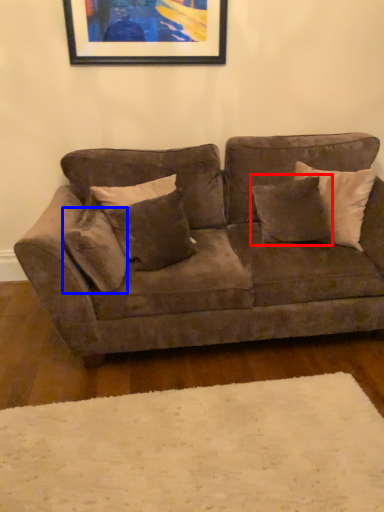
Question: Which point is further to the camera, pillow (highlighted by a red box) or pillow (highlighted by a blue box)?

Choices:
 (A) pillow
 (B) pillow

Answer: (A)